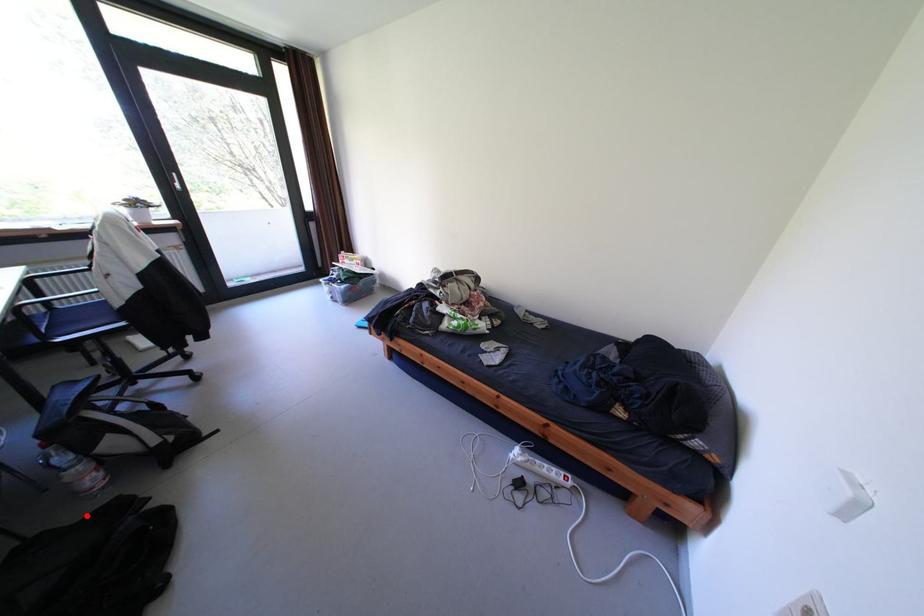
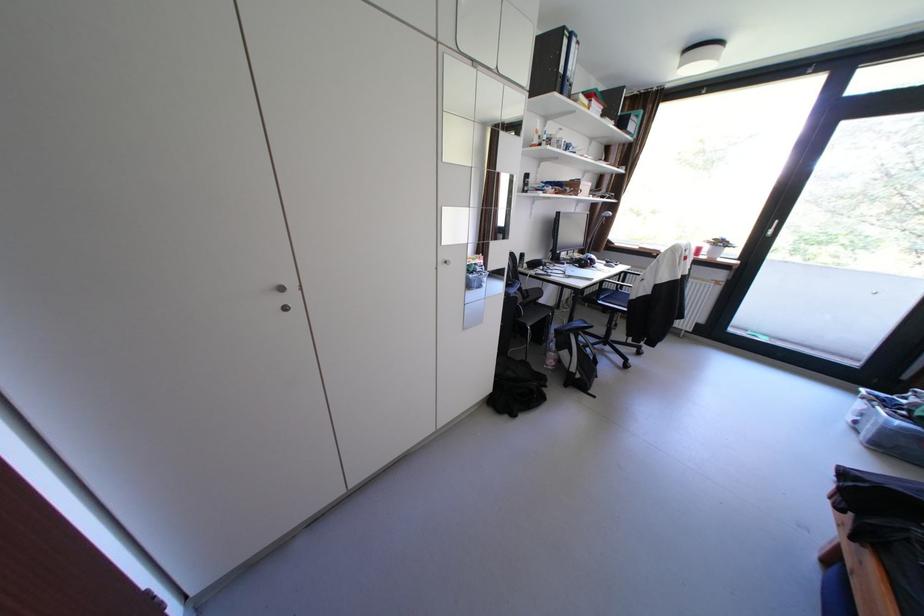
Question: I am providing you with two images of the same scene from different viewpoints. In image1, a red point is highlighted. Considering the same 3D point in image2, which of the following is correct?

Choices:
 (A) It is closer
 (B) It is farther

Answer: (A)